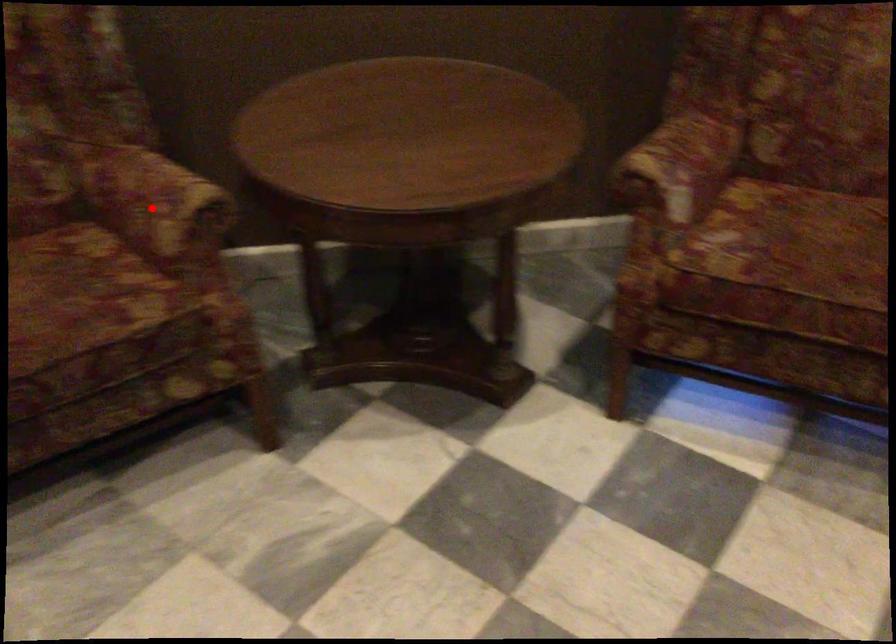
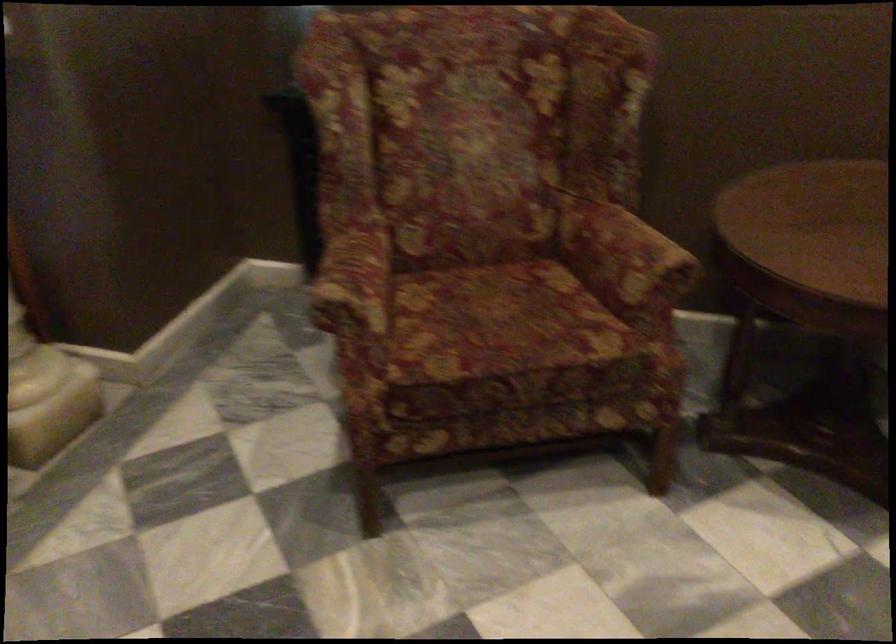
Question: I am providing you with two images of the same scene from different viewpoints. Given a red point in image1, look at the same physical point in image2. Is it:

Choices:
 (A) Closer to the viewpoint
 (B) Farther from the viewpoint

Answer: (B)